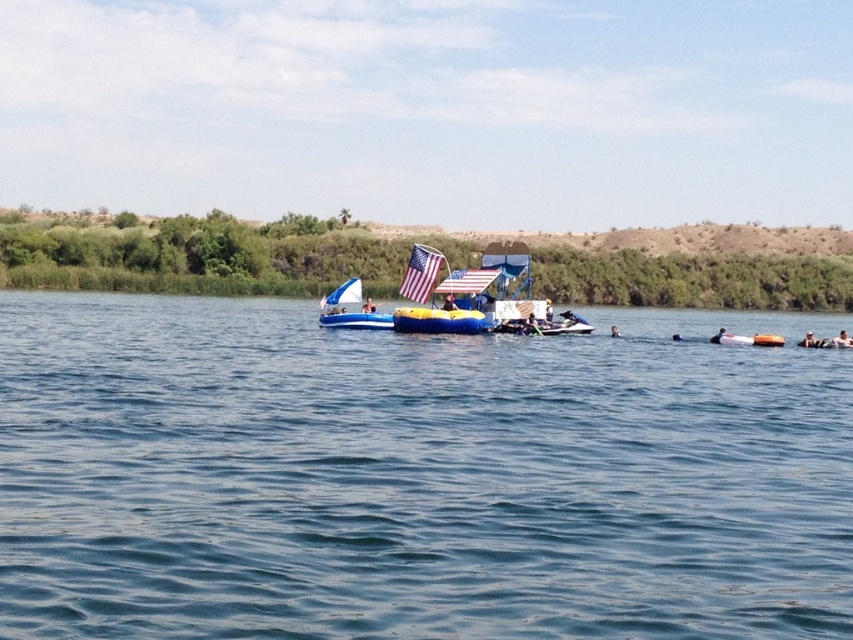
From the picture: Who is lower down, smooth skin person at lower right or smooth orange surfboard at lower right?

smooth orange surfboard at lower right is below.

Can you confirm if smooth skin person at lower right is positioned above smooth orange surfboard at lower right?

Correct, smooth skin person at lower right is located above smooth orange surfboard at lower right.

Identify the location of smooth skin person at lower right. This screenshot has height=640, width=853. (840, 340).

Does white plastic raft at lower right have a smaller size compared to matte blue inflatable boat at center?

Incorrect, white plastic raft at lower right is not smaller in size than matte blue inflatable boat at center.

Can you confirm if white plastic raft at lower right is wider than matte blue inflatable boat at center?

Correct, the width of white plastic raft at lower right exceeds that of matte blue inflatable boat at center.

What are the coordinates of `white plastic raft at lower right` in the screenshot? It's located at (747, 339).

The image size is (853, 640). What do you see at coordinates (345, 292) in the screenshot? I see `blue fabric flag at center` at bounding box center [345, 292].

Can you confirm if blue fabric flag at center is taller than smooth skin person at center?

Correct, blue fabric flag at center is much taller as smooth skin person at center.

You are a GUI agent. You are given a task and a screenshot of the screen. Output one action in this format:
    pyautogui.click(x=<x>, y=<y>)
    Task: Click on the blue fabric flag at center
    
    Given the screenshot: What is the action you would take?
    [345, 292]